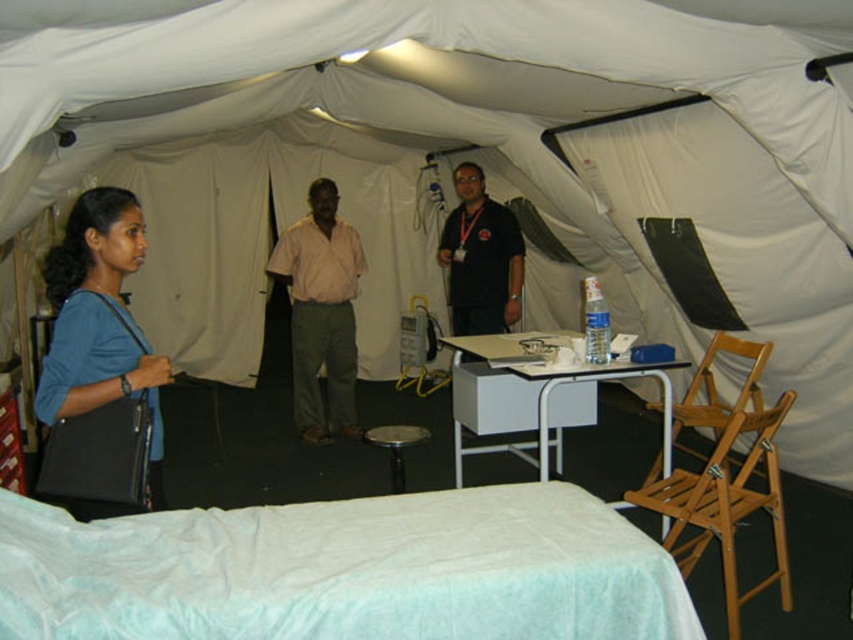
Question: Is white fabric bed at lower left bigger than white glossy table at center?

Choices:
 (A) no
 (B) yes

Answer: (A)

Question: Can you confirm if white glossy table at center is positioned to the right of pink cotton shirt at center?

Choices:
 (A) yes
 (B) no

Answer: (A)

Question: Can you confirm if white glossy table at center is positioned below black smooth shirt at center?

Choices:
 (A) yes
 (B) no

Answer: (A)

Question: Which of these objects is positioned closest to the metallic silver stool at center?

Choices:
 (A) matte black bag at lower left
 (B) pink cotton shirt at center
 (C) white fabric bed at lower left

Answer: (B)

Question: Which object is positioned farthest from the white glossy table at center?

Choices:
 (A) black smooth shirt at center
 (B) matte black bag at lower left

Answer: (B)

Question: Which is farther from the white fabric bed at lower left?

Choices:
 (A) pink cotton shirt at center
 (B) metallic silver stool at center
 (C) black smooth shirt at center

Answer: (A)